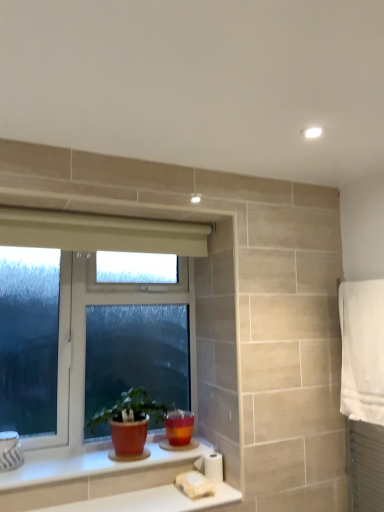
Identify the location of vacant point above white plastic window at lower left (from a real-world perspective). The width and height of the screenshot is (384, 512). (108, 253).